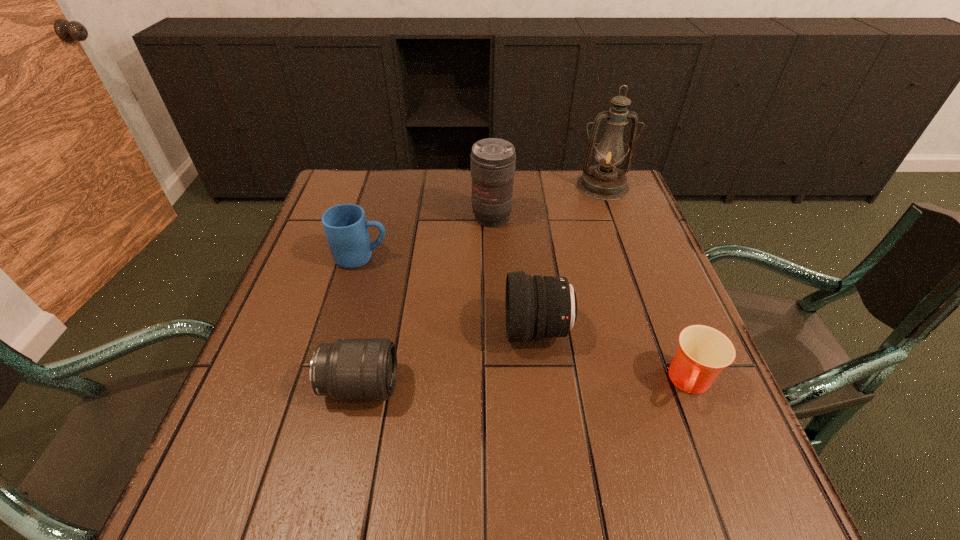
Find the location of a particular element. telephoto lens that stands as the second closest to the farthest telephoto lens is located at coordinates (349, 369).

At what (x,y) coordinates should I click in order to perform the action: click on blank area in the image that satisfies the following two spatial constraints: 1. at the front element of the cup; 2. on the left side of the second shortest telephoto lens. Please return your answer as a coordinate pair (x, y). Looking at the image, I should click on (543, 383).

Where is `vacant space that satisfies the following two spatial constraints: 1. on the side of the fifth shortest object where the control switches are located; 2. on the right side of the cup`? Image resolution: width=960 pixels, height=540 pixels. vacant space that satisfies the following two spatial constraints: 1. on the side of the fifth shortest object where the control switches are located; 2. on the right side of the cup is located at coordinates (497, 383).

You are a GUI agent. You are given a task and a screenshot of the screen. Output one action in this format:
    pyautogui.click(x=<x>, y=<y>)
    Task: Click on the free point that satisfies the following two spatial constraints: 1. on the side of the fifth shortest object where the control switches are located; 2. on the surface of the nearest telephoto lens
    
    Given the screenshot: What is the action you would take?
    pyautogui.click(x=497, y=386)

Find the location of a particular element. The height and width of the screenshot is (540, 960). vacant space that satisfies the following two spatial constraints: 1. on the side of the cup where the control switches are located; 2. on the left side of the farthest telephoto lens is located at coordinates (497, 383).

Where is `vacant space that satisfies the following two spatial constraints: 1. at the front element of the second tallest telephoto lens; 2. on the right side of the cup`? vacant space that satisfies the following two spatial constraints: 1. at the front element of the second tallest telephoto lens; 2. on the right side of the cup is located at coordinates (543, 383).

I want to click on free spot that satisfies the following two spatial constraints: 1. on the side of the farthest telephoto lens where the control switches are located; 2. on the right side of the cup, so click(497, 383).

Find the location of a particular element. This screenshot has height=540, width=960. free region that satisfies the following two spatial constraints: 1. on the side of the tallest telephoto lens where the control switches are located; 2. on the side of the mug with the handle is located at coordinates (493, 258).

Where is `free spot that satisfies the following two spatial constraints: 1. on the back side of the cup; 2. at the front element of the second nearest telephoto lens`? Image resolution: width=960 pixels, height=540 pixels. free spot that satisfies the following two spatial constraints: 1. on the back side of the cup; 2. at the front element of the second nearest telephoto lens is located at coordinates (669, 330).